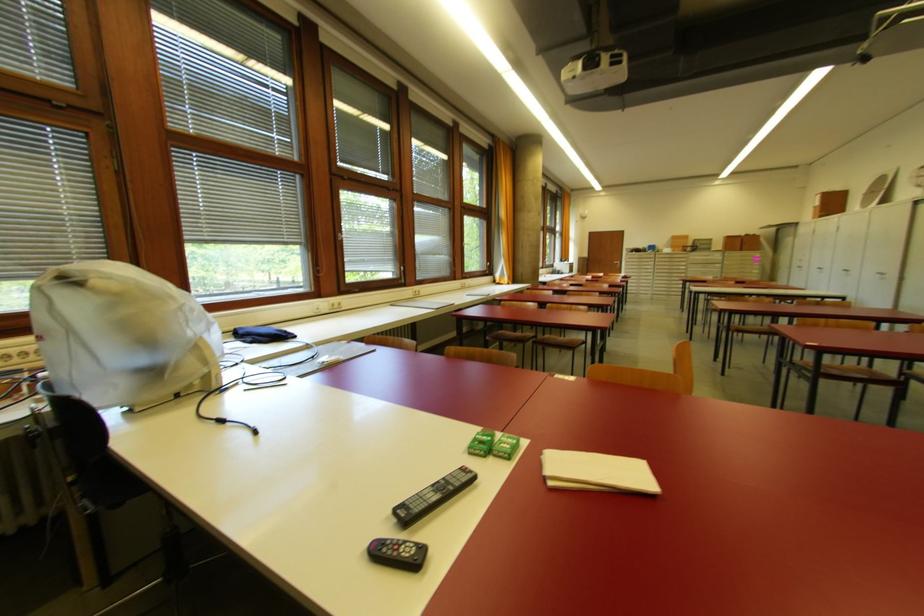
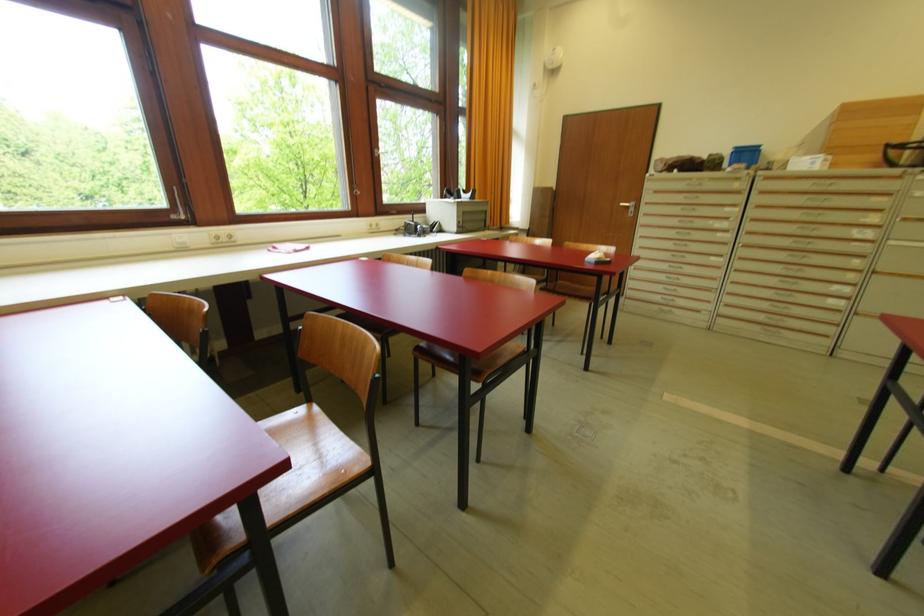
In the second image, find the point that corresponds to (619,265) in the first image.

(629, 209)